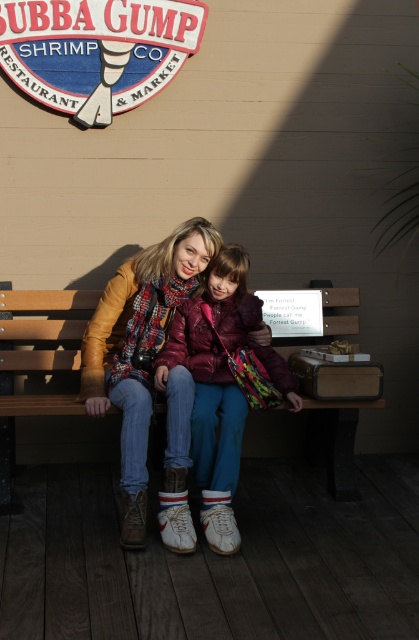
Is matte plaid scarf at center bigger than wooden sign at upper left?

Yes.

How much distance is there between matte plaid scarf at center and wooden sign at upper left?

matte plaid scarf at center is 5.73 feet from wooden sign at upper left.

You are a GUI agent. You are given a task and a screenshot of the screen. Output one action in this format:
    pyautogui.click(x=<x>, y=<y>)
    Task: Click on the matte plaid scarf at center
    
    Given the screenshot: What is the action you would take?
    pyautogui.click(x=139, y=348)

At what (x,y) coordinates should I click in order to perform the action: click on matte plaid scarf at center. Please return your answer as a coordinate pair (x, y). This screenshot has width=419, height=640. Looking at the image, I should click on (139, 348).

Which of these two, matte plaid scarf at center or matte purple jacket at center, stands shorter?

Standing shorter between the two is matte purple jacket at center.

This screenshot has height=640, width=419. What do you see at coordinates (139, 348) in the screenshot?
I see `matte plaid scarf at center` at bounding box center [139, 348].

In order to click on matte plaid scarf at center in this screenshot , I will do `click(139, 348)`.

Is matte plaid scarf at center below wooden bench at center?

No.

Is matte plaid scarf at center positioned before wooden bench at center?

Yes, it is in front of wooden bench at center.

This screenshot has width=419, height=640. What do you see at coordinates (139, 348) in the screenshot?
I see `matte plaid scarf at center` at bounding box center [139, 348].

You are a GUI agent. You are given a task and a screenshot of the screen. Output one action in this format:
    pyautogui.click(x=<x>, y=<y>)
    Task: Click on the matte plaid scarf at center
    
    Given the screenshot: What is the action you would take?
    pyautogui.click(x=139, y=348)